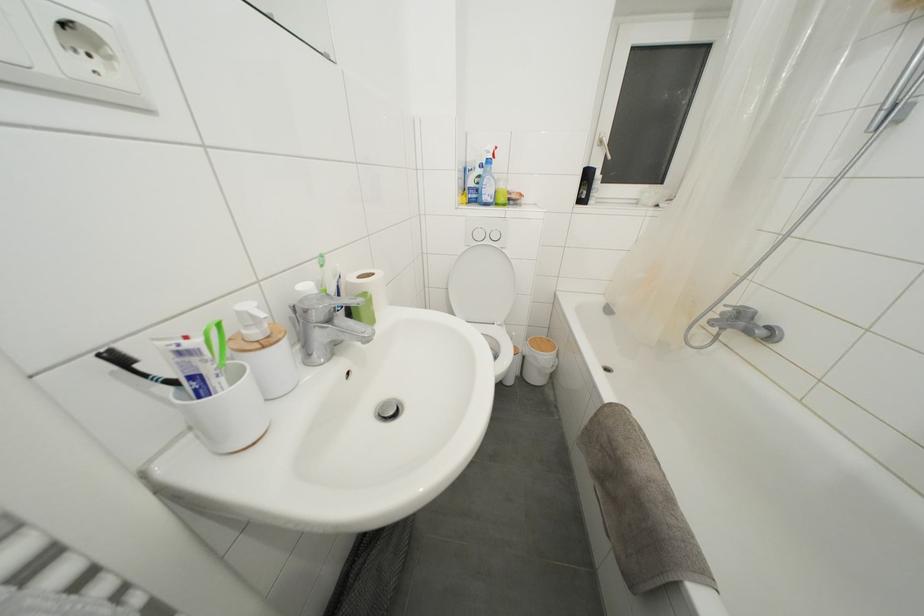
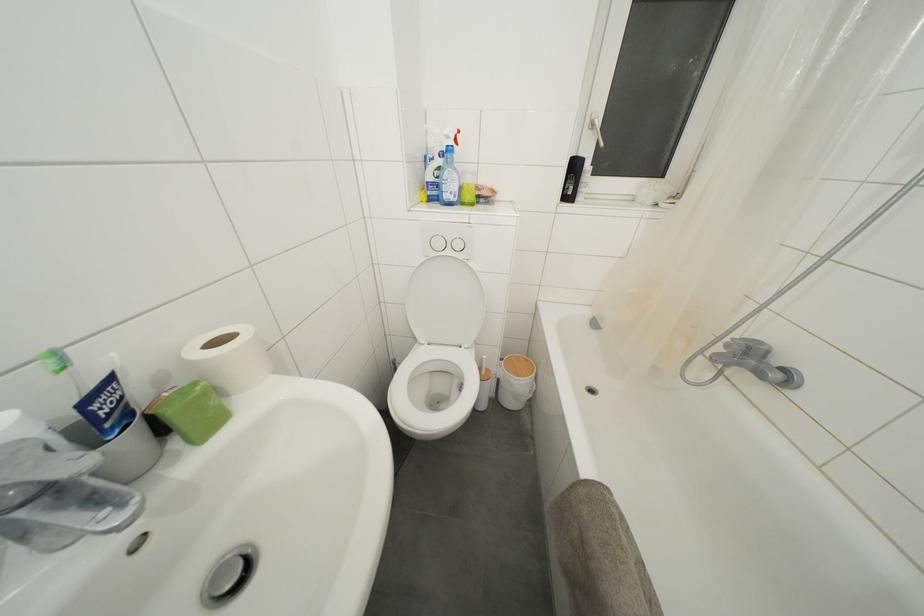
In the second image, find the point that corresponds to the point at 604,148 in the first image.

(597, 131)